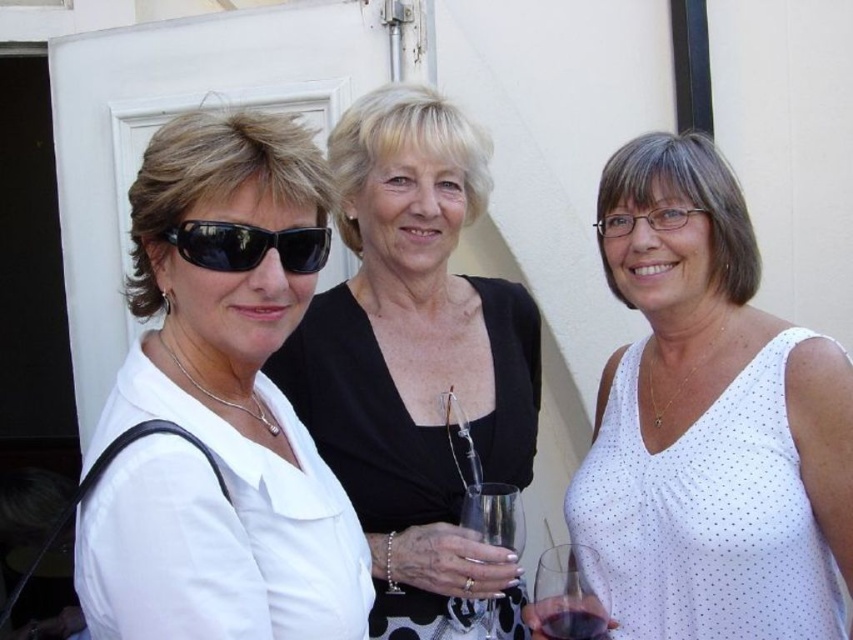
Question: Which point is closer to the camera?

Choices:
 (A) (592, 628)
 (B) (405, 625)
 (C) (309, 227)
 (D) (244, 284)

Answer: (D)

Question: Does white matte shirt at left appear under clear glass wine glass at center?

Choices:
 (A) no
 (B) yes

Answer: (A)

Question: Based on their relative distances, which object is farther from the white matte shirt at left?

Choices:
 (A) white dotted tank top at center
 (B) translucent glass at center
 (C) black plastic sunglasses at left
 (D) black matte dress at center

Answer: (A)

Question: Can you confirm if white matte shirt at left is positioned to the left of transparent glass wine glass at lower right?

Choices:
 (A) yes
 (B) no

Answer: (A)

Question: Is the position of black plastic sunglasses at left more distant than that of clear glass wine glass at center?

Choices:
 (A) yes
 (B) no

Answer: (B)

Question: Based on their relative distances, which object is farther from the clear glass wine glass at center?

Choices:
 (A) white matte shirt at left
 (B) translucent glass at center
 (C) white dotted tank top at center

Answer: (A)